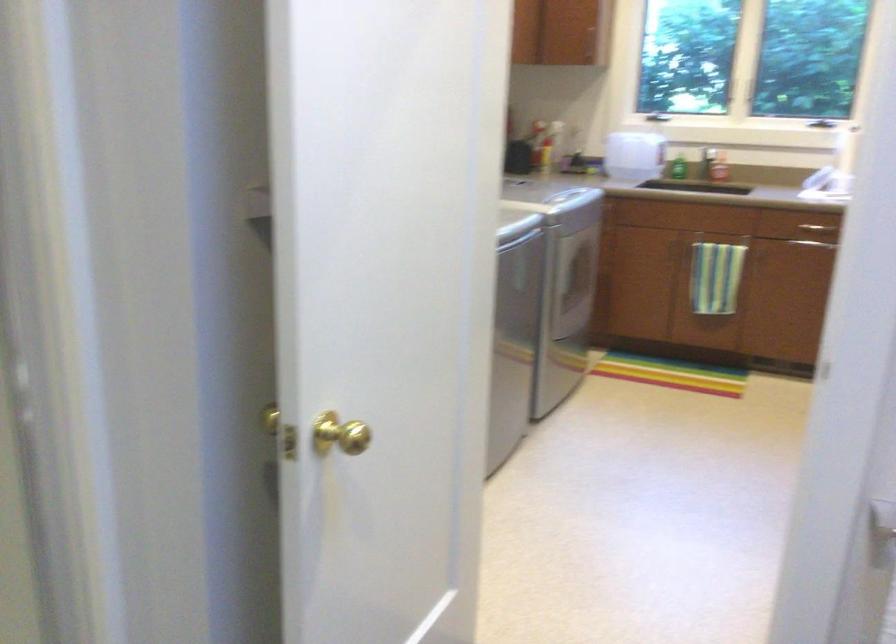
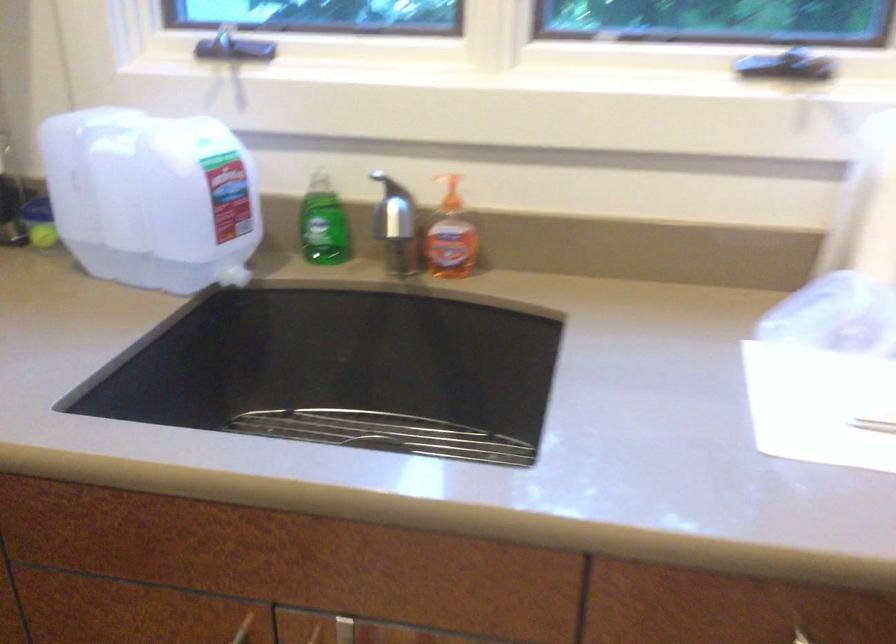
In the second image, find the point that corresponds to (x=657, y=108) in the first image.

(243, 48)